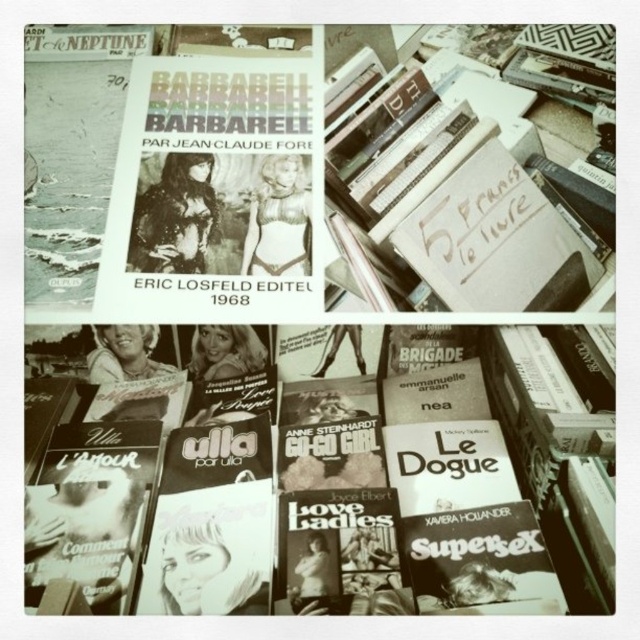
Describe the element at coordinates (292, 499) in the screenshot. I see `soft matte book at center` at that location.

Does point (408, 483) lie behind point (372, 212)?

That is True.

Is point (310, 580) farther from camera compared to point (508, 262)?

No, (310, 580) is closer to viewer.

This screenshot has width=640, height=640. Identify the location of soft matte book at center. (292, 499).